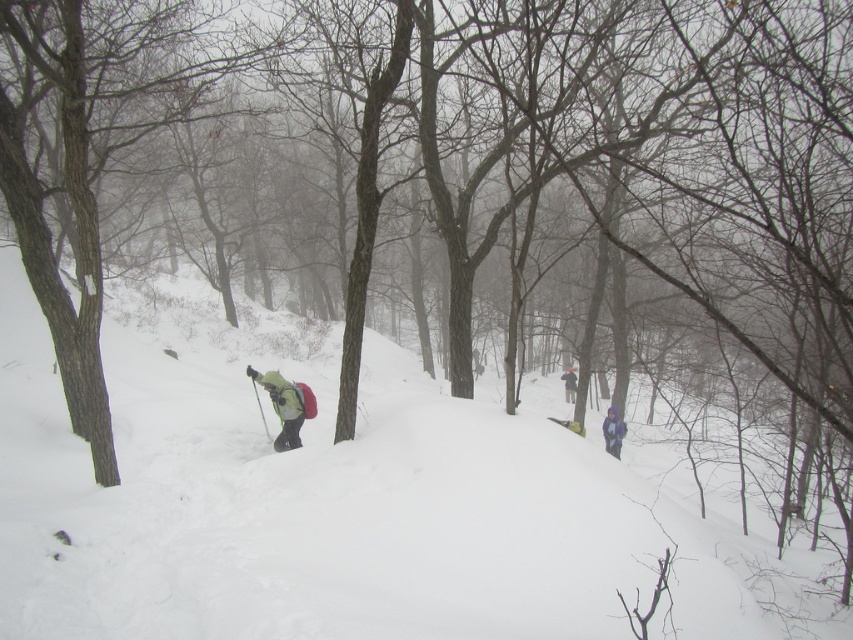
At what (x,y) coordinates should I click in order to perform the action: click on white fluffy snow at center. Please return your answer as a coordinate pair (x, y). This screenshot has width=853, height=640. Looking at the image, I should click on (343, 502).

Does white fluffy snow at center appear over purple fabric jacket at center-right?

Indeed, white fluffy snow at center is positioned over purple fabric jacket at center-right.

Image resolution: width=853 pixels, height=640 pixels. I want to click on white fluffy snow at center, so click(x=343, y=502).

Does purple fleece jacket at lower right appear over green plastic ski at center?

No.

Identify the location of purple fleece jacket at lower right. This screenshot has height=640, width=853. (613, 432).

Image resolution: width=853 pixels, height=640 pixels. In order to click on purple fleece jacket at lower right in this screenshot , I will do `click(613, 432)`.

From the picture: Can you confirm if white fluffy snow at center is positioned to the left of green matte jacket at center?

Incorrect, white fluffy snow at center is not on the left side of green matte jacket at center.

Between point (173, 424) and point (293, 436), which one is positioned behind?

The point (173, 424) is behind.

You are a GUI agent. You are given a task and a screenshot of the screen. Output one action in this format:
    pyautogui.click(x=<x>, y=<y>)
    Task: Click on the white fluffy snow at center
    The image size is (853, 640).
    Given the screenshot: What is the action you would take?
    pyautogui.click(x=343, y=502)